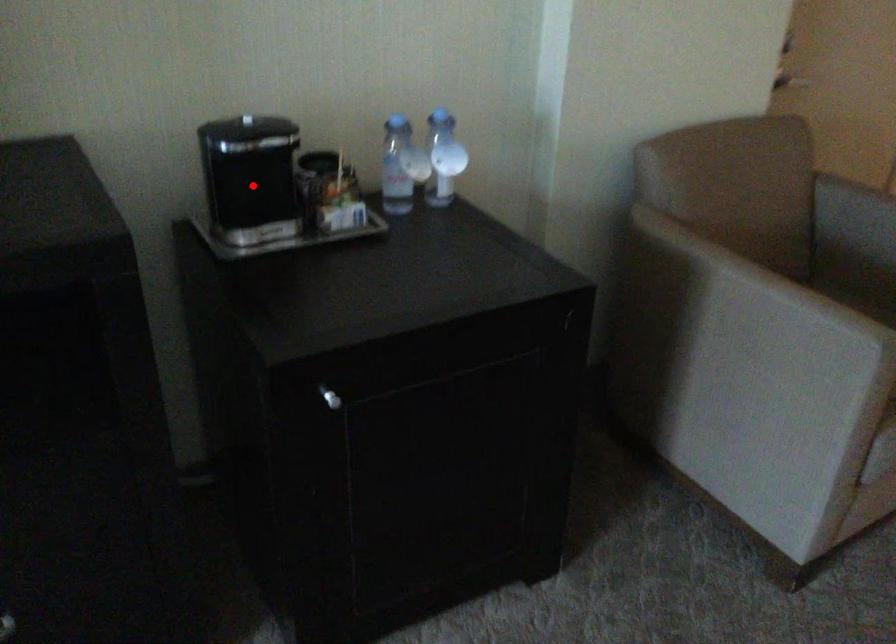
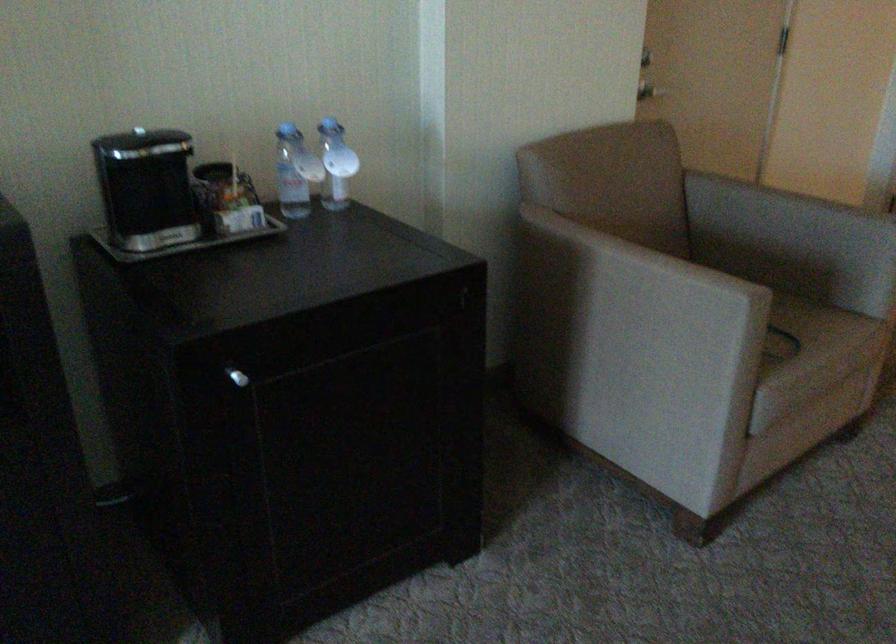
The point at the highlighted location is marked in the first image. Where is the corresponding point in the second image?

(149, 194)